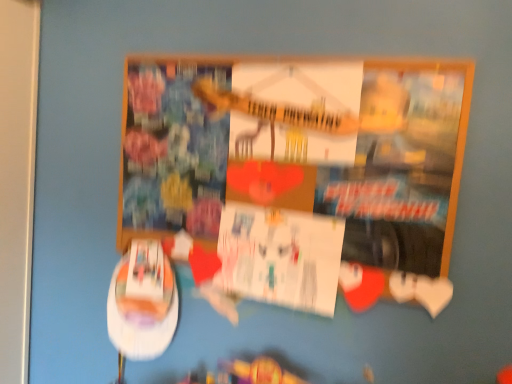
Question: Should I look upward or downward to see wooden frame poster at center?

Choices:
 (A) up
 (B) down

Answer: (A)